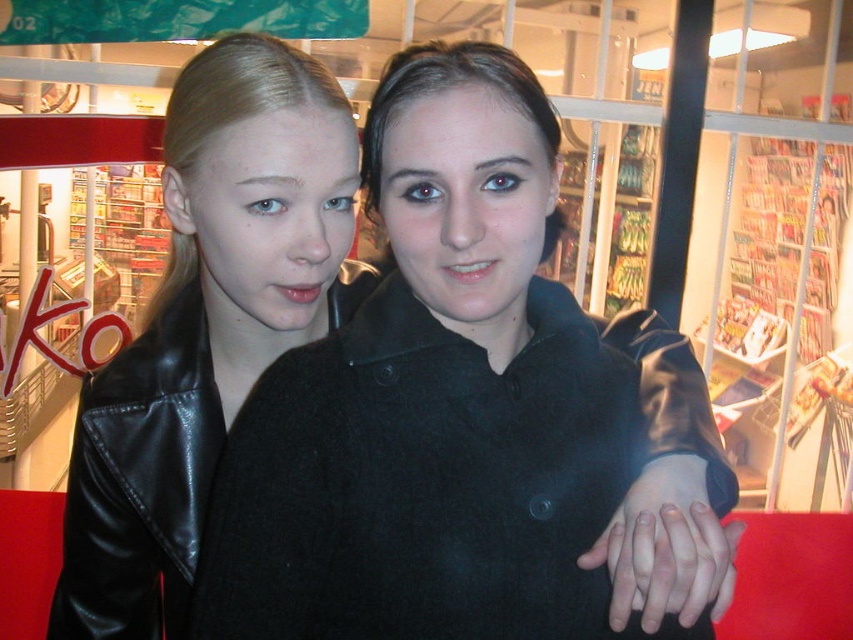
You are a store employee who needs to ensure that the black leather jacket at center and the black leather jacket at left are not overlapping in the display. Can you confirm if they are currently overlapping?

The black leather jacket at center is positioned over the black leather jacket at left, so yes, they are overlapping in the display.

You are trying to locate the black leather jacket at center in the image. Can you confirm if it is positioned at the coordinates point [467,417]?

Yes, the black leather jacket at center is located at point [467,417].

Based on the photo, you are a store employee tasked with arranging items on a shelf. You have two black leather jackets to place. The black leather jacket at center and the black leather jacket at left. Based on their sizes, which one should you place on the lower shelf to save space?

The black leather jacket at center has a lesser height compared to the black leather jacket at left, so it should be placed on the lower shelf to save space.